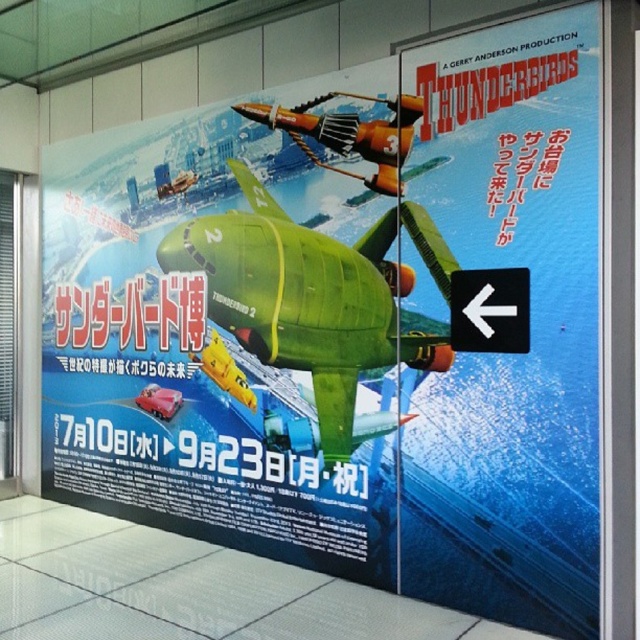
Between point (236, 339) and point (266, 104), which one is positioned behind?

Point (236, 339)

Is green matte thunderbird 2 at center shorter than orange metallic airplane at center?

No.

Who is more distant from viewer, (x=259, y=349) or (x=282, y=128)?

Point (x=259, y=349)

At what (x,y) coordinates should I click in order to perform the action: click on green matte thunderbird 2 at center. Please return your answer as a coordinate pair (x, y). Looking at the image, I should click on (316, 296).